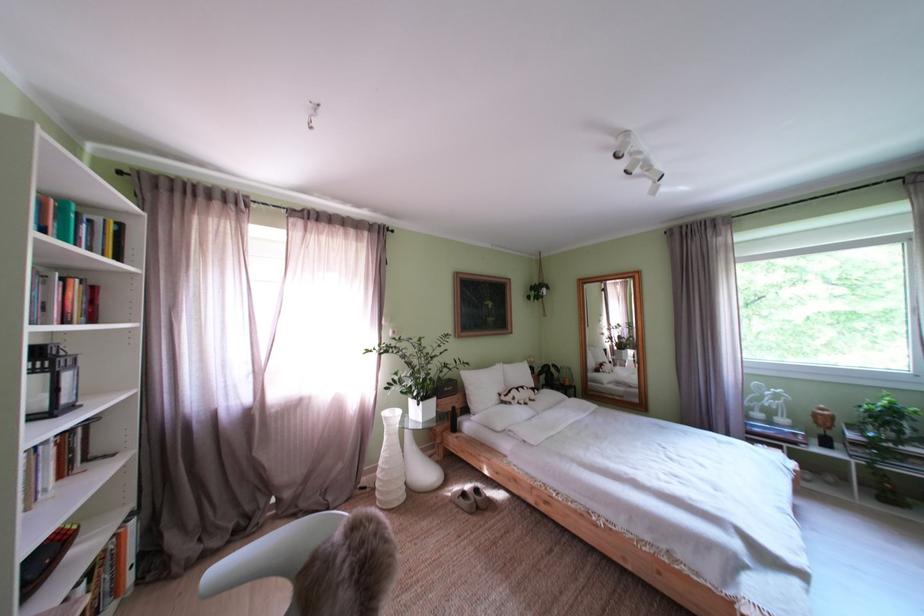
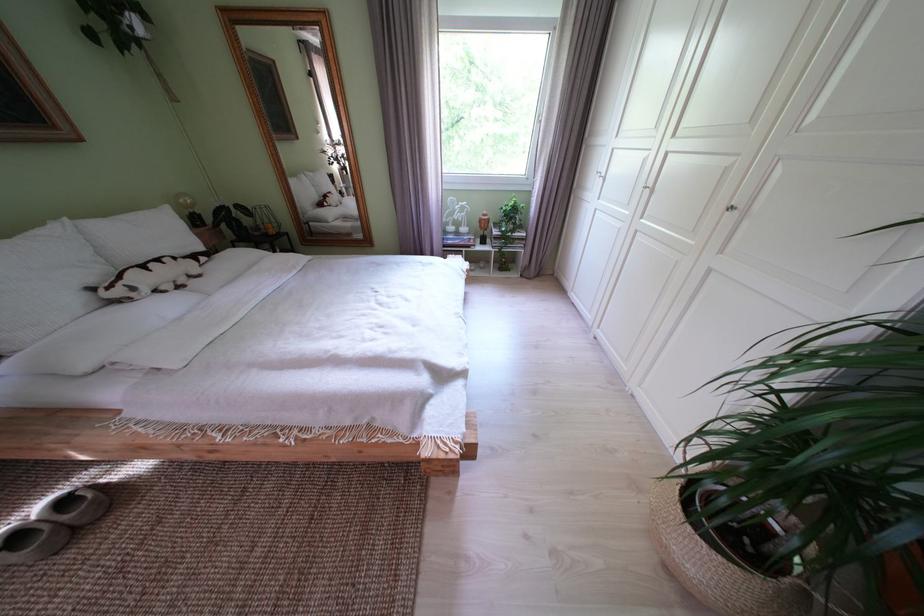
Looking at this image, the first image is from the beginning of the video and the second image is from the end. How did the camera likely rotate when shooting the video?

The rotation direction of the camera is right-down.